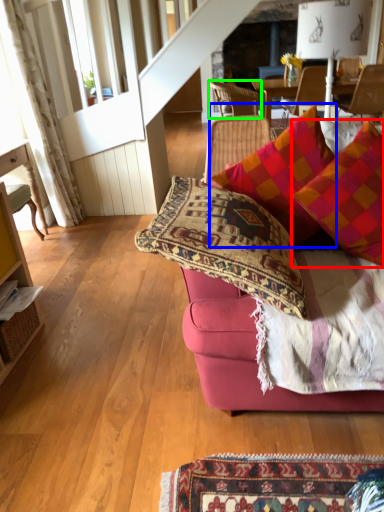
Question: Which is nearer to the pillow (highlighted by a red box)? pillow (highlighted by a blue box) or chair (highlighted by a green box).

Choices:
 (A) pillow
 (B) chair

Answer: (A)